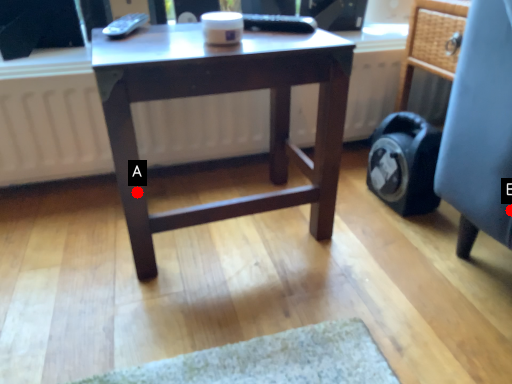
Question: Two points are circled on the image, labeled by A and B beside each circle. Which of the following is the closest to the observer?

Choices:
 (A) A is closer
 (B) B is closer

Answer: (B)